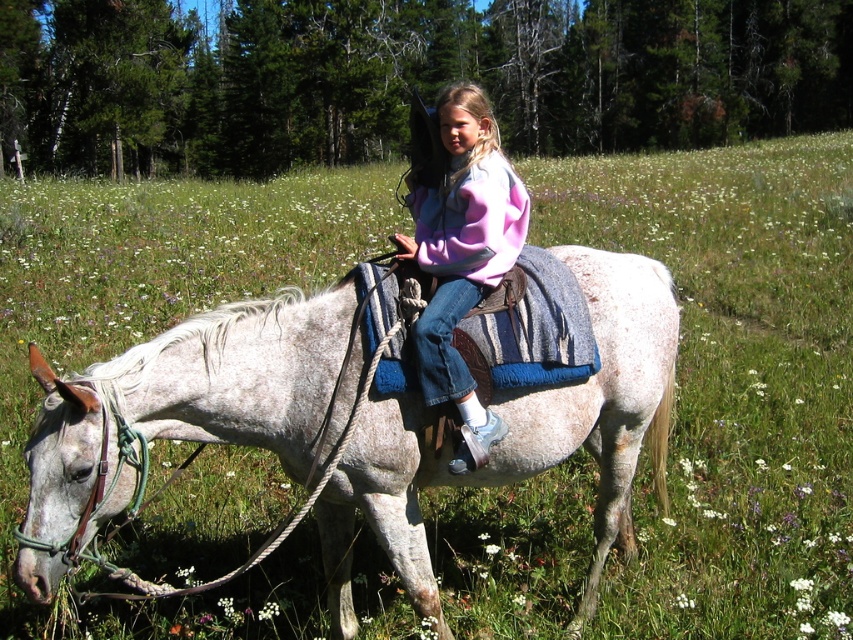
Can you confirm if speckled white horse at center is shorter than pastel fleece sweater at center?

Correct, speckled white horse at center is not as tall as pastel fleece sweater at center.

The height and width of the screenshot is (640, 853). Describe the element at coordinates (519, 440) in the screenshot. I see `speckled white horse at center` at that location.

The height and width of the screenshot is (640, 853). What are the coordinates of `speckled white horse at center` in the screenshot? It's located at (519, 440).